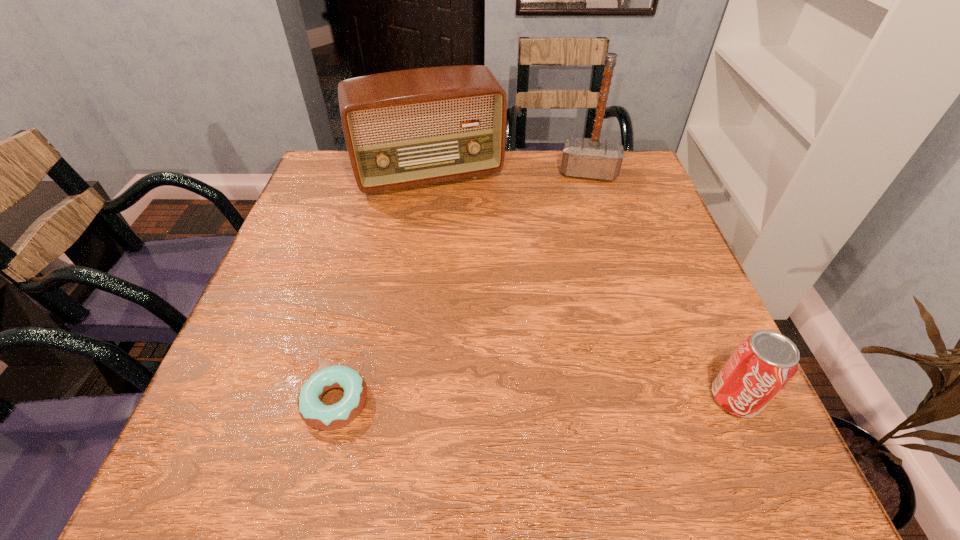
In the image, there is a desktop. Where is `blank space at the near left corner`? Image resolution: width=960 pixels, height=540 pixels. blank space at the near left corner is located at coordinates (211, 421).

Where is `empty location between the second shortest object and the doughnut`? empty location between the second shortest object and the doughnut is located at coordinates (536, 400).

Where is `free point between the second tallest object and the hammer`? free point between the second tallest object and the hammer is located at coordinates (509, 174).

Where is `vacant area that lies between the shortest object and the radio receiver`? The width and height of the screenshot is (960, 540). vacant area that lies between the shortest object and the radio receiver is located at coordinates (382, 288).

Locate an element on the screen. Image resolution: width=960 pixels, height=540 pixels. vacant area between the rightmost object and the radio receiver is located at coordinates (582, 287).

Where is `blank region between the doughnut and the third shortest object`? Image resolution: width=960 pixels, height=540 pixels. blank region between the doughnut and the third shortest object is located at coordinates (382, 288).

The height and width of the screenshot is (540, 960). I want to click on vacant area between the hammer and the rightmost object, so click(661, 286).

Where is `free area in between the shortest object and the second tallest object`? The height and width of the screenshot is (540, 960). free area in between the shortest object and the second tallest object is located at coordinates (382, 288).

Where is `vacant point located between the radio receiver and the shortest object`? The height and width of the screenshot is (540, 960). vacant point located between the radio receiver and the shortest object is located at coordinates (382, 288).

The width and height of the screenshot is (960, 540). Find the location of `free spot between the doughnut and the second tallest object`. free spot between the doughnut and the second tallest object is located at coordinates (382, 288).